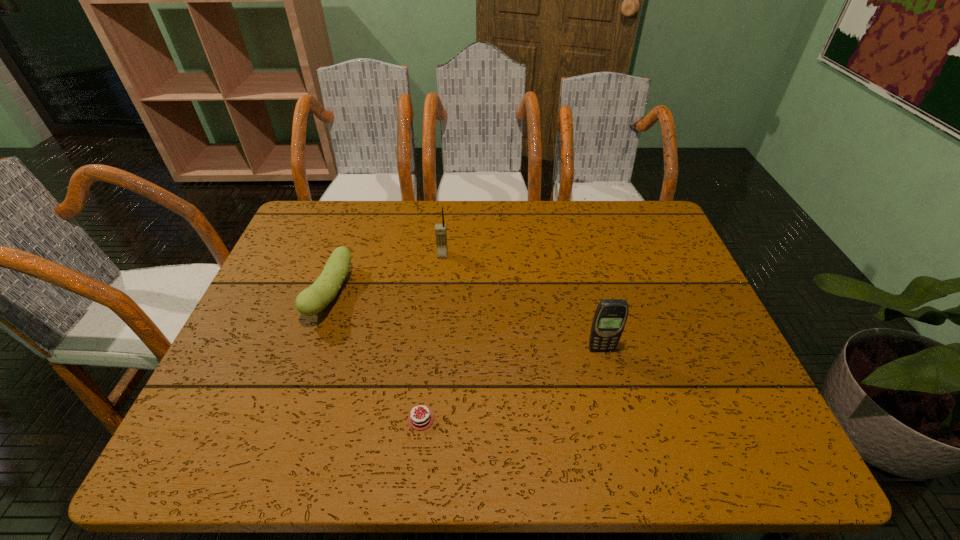
The width and height of the screenshot is (960, 540). Identify the location of the closest object to the nearest object. (312, 300).